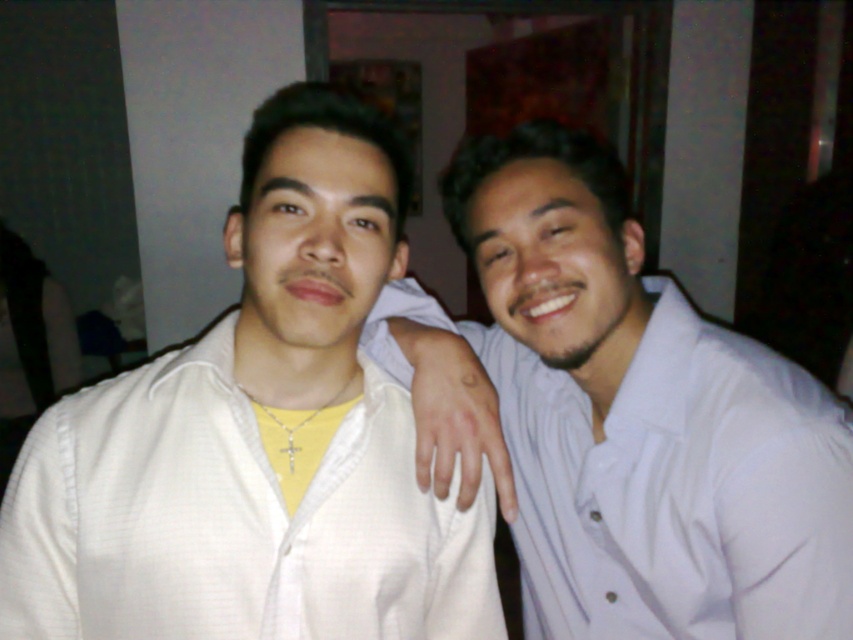
Question: Is the position of white textured shirt at left less distant than that of white striped shirt at right?

Choices:
 (A) yes
 (B) no

Answer: (A)

Question: Which object is closer to the camera taking this photo?

Choices:
 (A) white textured shirt at left
 (B) white striped shirt at right

Answer: (A)

Question: Is white textured shirt at left bigger than white striped shirt at right?

Choices:
 (A) yes
 (B) no

Answer: (B)

Question: Is white textured shirt at left bigger than white striped shirt at right?

Choices:
 (A) no
 (B) yes

Answer: (A)